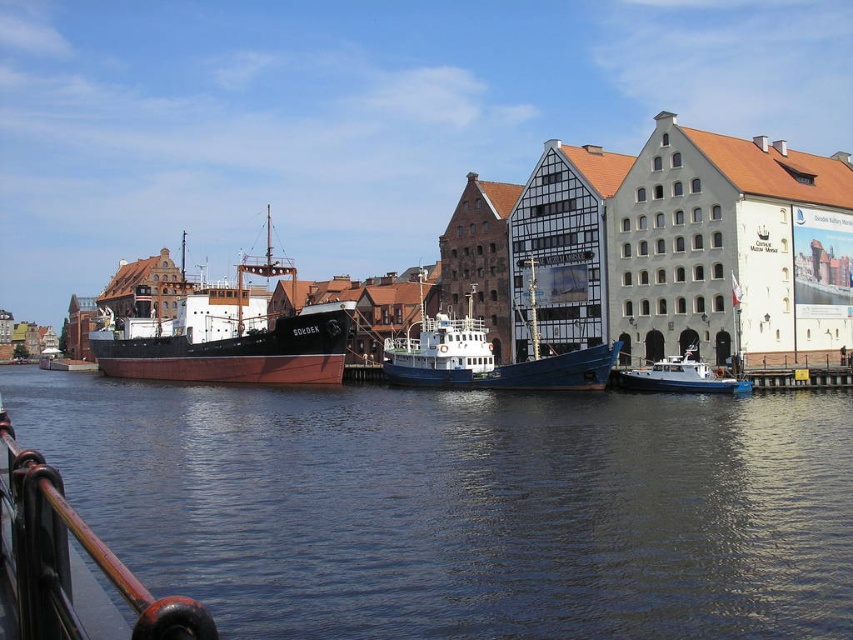
You are a tour guide explaining the scene to visitors. You mention the dark blue water at center and the polished metal railing at lower left. Which object is wider in this image?

The dark blue water at center is wider than the polished metal railing at lower left according to the description.

You are standing at the waterfront and want to reach a specific point marked at coordinates point (132, 326). If your maximum comfortable walking distance is 400 feet, will you need to walk further than that to reach it?

The distance of point (132, 326) from the camera is 419.10 feet, which is beyond your maximum comfortable walking distance of 400 feet. Therefore, you will need to walk further than that to reach it.

You are standing on the dock and see the dark blue water at center and the white matte boat at lower right. Which object is closer to the water surface?

The white matte boat at lower right is closer to the water surface because the dark blue water at center is below it.